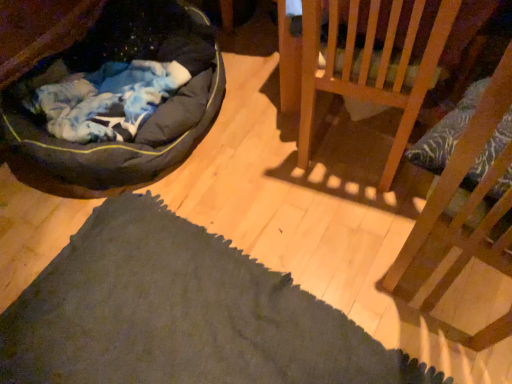
Where is `free space in front of wooden chair at upper right, arranged as the first furniture when viewed from the back`? This screenshot has height=384, width=512. free space in front of wooden chair at upper right, arranged as the first furniture when viewed from the back is located at coordinates (357, 204).